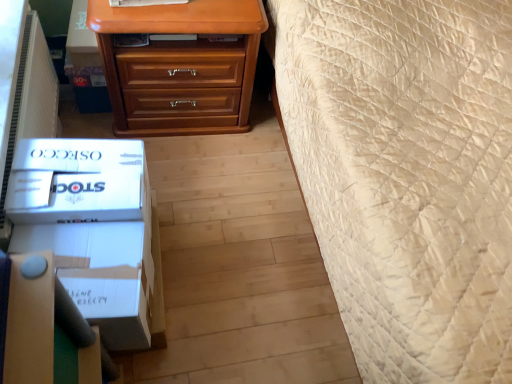
Where is `free location in front of matte wood chest of drawers at upper center`? This screenshot has height=384, width=512. free location in front of matte wood chest of drawers at upper center is located at coordinates (199, 182).